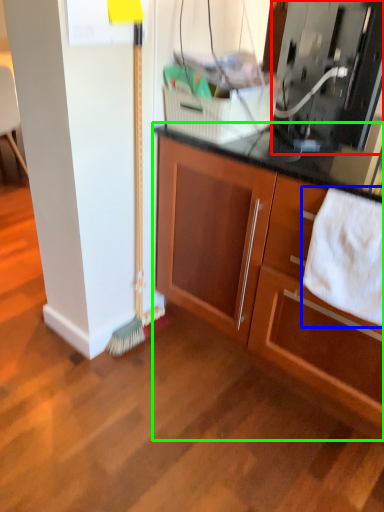
Question: Considering the real-world distances, which object is farthest from appliance (highlighted by a red box)? bath towel (highlighted by a blue box) or cabinetry (highlighted by a green box)?

Choices:
 (A) bath towel
 (B) cabinetry

Answer: (B)